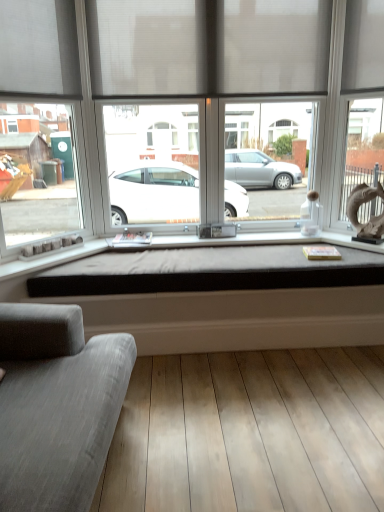
Question: Should I look upward or downward to see light brown wood floor at lower center?

Choices:
 (A) down
 (B) up

Answer: (A)

Question: Would you say matte gray curtain at upper center is outside light brown wood floor at lower center?

Choices:
 (A) no
 (B) yes

Answer: (B)

Question: From a real-world perspective, is matte gray curtain at upper center positioned under light brown wood floor at lower center based on gravity?

Choices:
 (A) no
 (B) yes

Answer: (A)

Question: From a real-world perspective, is matte gray curtain at upper center over light brown wood floor at lower center?

Choices:
 (A) no
 (B) yes

Answer: (B)

Question: Could you tell me if matte gray curtain at upper center is turned towards light brown wood floor at lower center?

Choices:
 (A) yes
 (B) no

Answer: (B)

Question: Can you confirm if matte gray curtain at upper center is shorter than light brown wood floor at lower center?

Choices:
 (A) no
 (B) yes

Answer: (A)

Question: Is matte gray curtain at upper center taller than light brown wood floor at lower center?

Choices:
 (A) yes
 (B) no

Answer: (A)

Question: Can you confirm if matte gray curtain at upper center is positioned to the right of gray fabric couch at lower left?

Choices:
 (A) yes
 (B) no

Answer: (A)

Question: Could gray fabric couch at lower left be considered to be inside matte gray curtain at upper center?

Choices:
 (A) yes
 (B) no

Answer: (B)

Question: Is matte gray curtain at upper center far away from gray fabric couch at lower left?

Choices:
 (A) yes
 (B) no

Answer: (A)

Question: Is matte gray curtain at upper center in contact with gray fabric couch at lower left?

Choices:
 (A) yes
 (B) no

Answer: (B)

Question: Is matte gray curtain at upper center smaller than gray fabric couch at lower left?

Choices:
 (A) yes
 (B) no

Answer: (A)

Question: Is matte gray curtain at upper center looking in the opposite direction of gray fabric couch at lower left?

Choices:
 (A) no
 (B) yes

Answer: (A)

Question: Is light brown wood floor at lower center closer to the viewer compared to matte gray window at center?

Choices:
 (A) no
 (B) yes

Answer: (B)